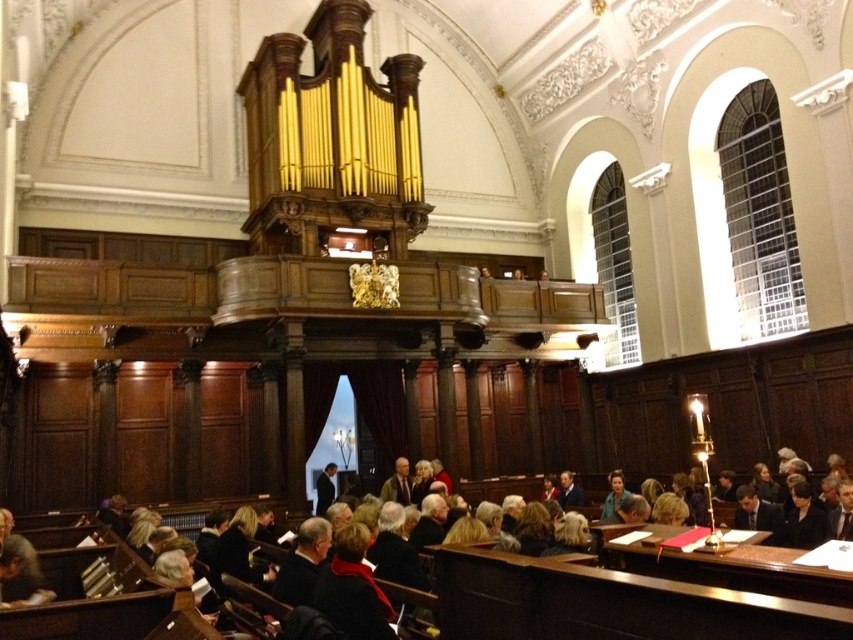
Does green fabric jacket at center appear on the left side of dark brown leather jacket at center?

Incorrect, green fabric jacket at center is not on the left side of dark brown leather jacket at center.

Can you confirm if green fabric jacket at center is thinner than dark brown leather jacket at center?

Incorrect, green fabric jacket at center's width is not less than dark brown leather jacket at center's.

What do you see at coordinates (613, 493) in the screenshot?
I see `green fabric jacket at center` at bounding box center [613, 493].

At what (x,y) coordinates should I click in order to perform the action: click on green fabric jacket at center. Please return your answer as a coordinate pair (x, y). This screenshot has width=853, height=640. Looking at the image, I should click on (613, 493).

Who is lower down, light brown leather jacket at center or dark suit at center?

dark suit at center

Is light brown leather jacket at center further to camera compared to dark suit at center?

That is False.

Is point (404, 497) closer to camera compared to point (317, 513)?

Yes, point (404, 497) is in front of point (317, 513).

I want to click on light brown leather jacket at center, so click(x=397, y=483).

Is dark brown leather jacket at lower center to the left of light brown leather jacket at center from the viewer's perspective?

Incorrect, dark brown leather jacket at lower center is not on the left side of light brown leather jacket at center.

Which of these two, dark brown leather jacket at lower center or light brown leather jacket at center, stands shorter?

Standing shorter between the two is light brown leather jacket at center.

Locate an element on the screen. dark brown leather jacket at lower center is located at coordinates (607, 604).